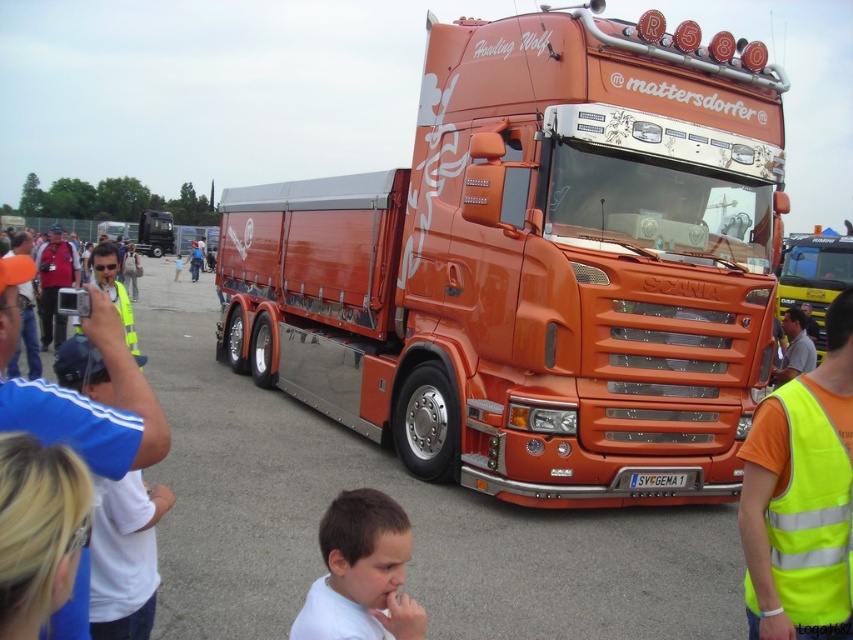
You are a photographer standing at the event. You need to take a photo that includes both the orange metallic truck at center and the neon yellow reflective safety vest at lower right. Based on their positions, which object should be placed on the left side of the photo to ensure both are visible?

The neon yellow reflective safety vest at lower right should be placed on the left side of the photo because the orange metallic truck at center is to the right of it, ensuring both are visible in the frame.

You are a photographer at the event and want to capture both the neon yellow reflective safety vest at lower right and the white matte shirt at lower center in the same frame. Based on their positions, which object should you focus on first to ensure both are in focus?

The neon yellow reflective safety vest at lower right is above the white matte shirt at lower center. To ensure both are in focus, you should focus on the white matte shirt at lower center first since it is closer to the camera, and the vest will naturally fall into focus as it is behind.

You are a photographer at the event and need to capture both the orange metallic truck at center and the white matte shirt at lower center in a single frame. Given their sizes, which object should you focus on to ensure both are visible without cropping?

Since the orange metallic truck at center occupies less space than the white matte shirt at lower center, you should focus on the white matte shirt at lower center to ensure both objects fit in the frame without cropping.